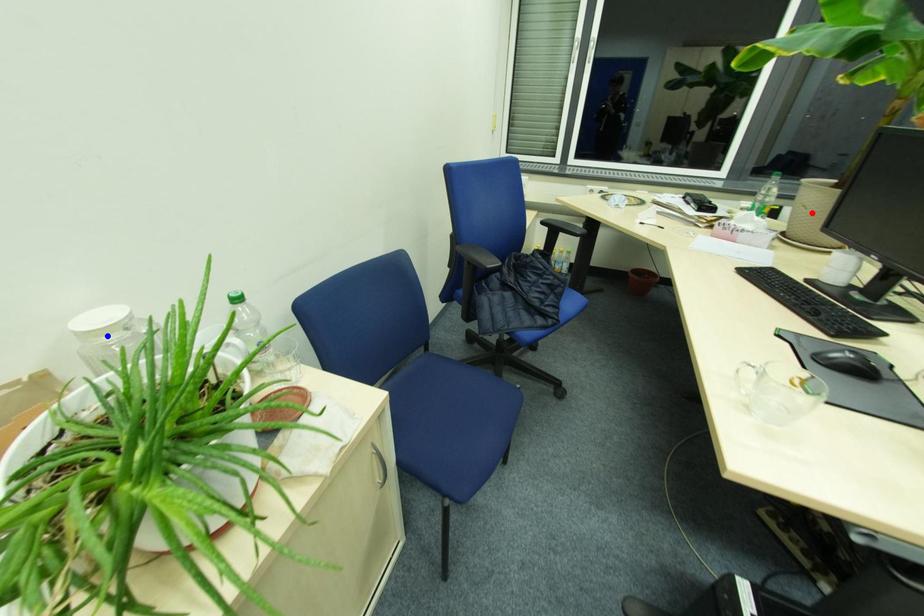
Question: Which of the two points in the image is closer to the camera?

Choices:
 (A) Blue point is closer.
 (B) Red point is closer.

Answer: (A)